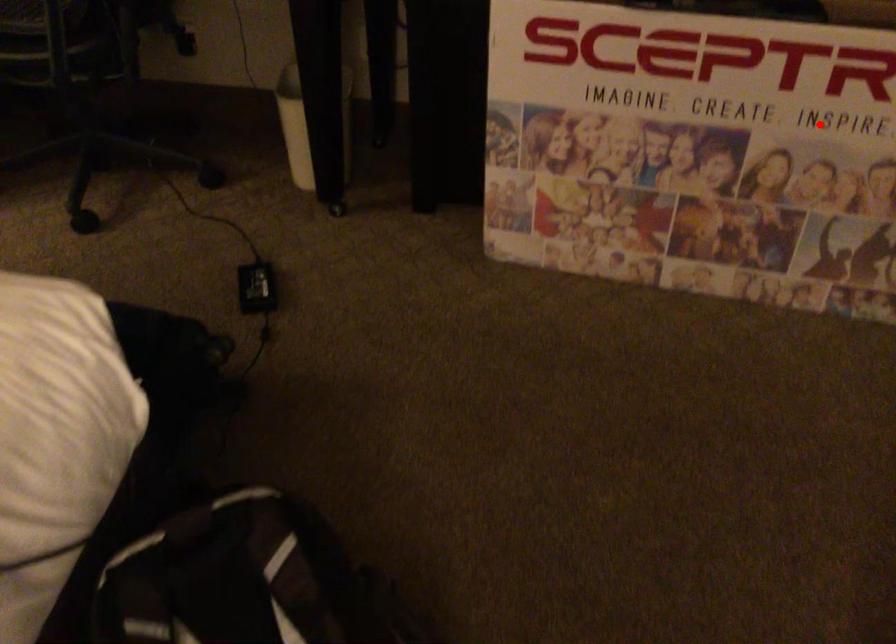
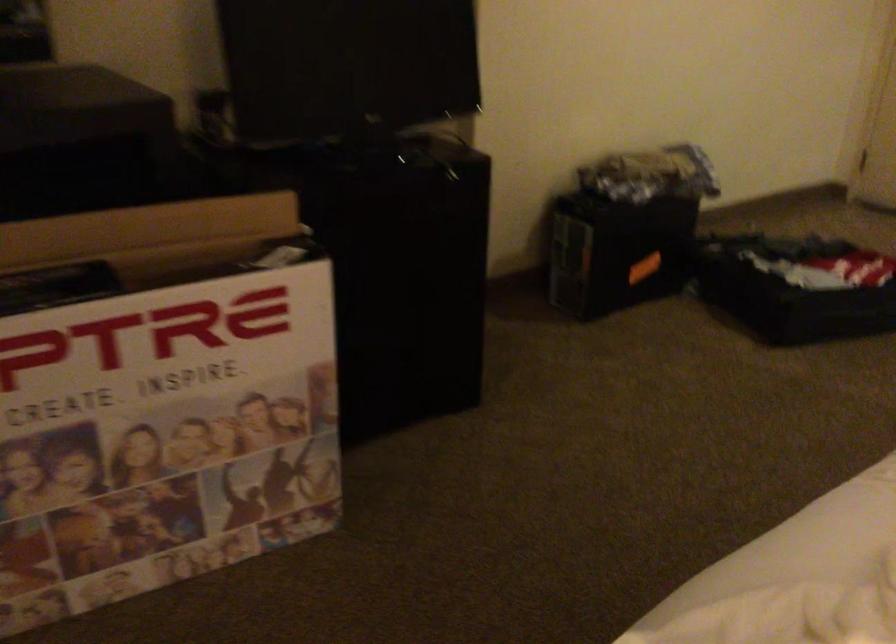
Question: I am providing you with two images of the same scene from different viewpoints. Given a red point in image1, look at the same physical point in image2. Is it:

Choices:
 (A) Closer to the viewpoint
 (B) Farther from the viewpoint

Answer: (A)